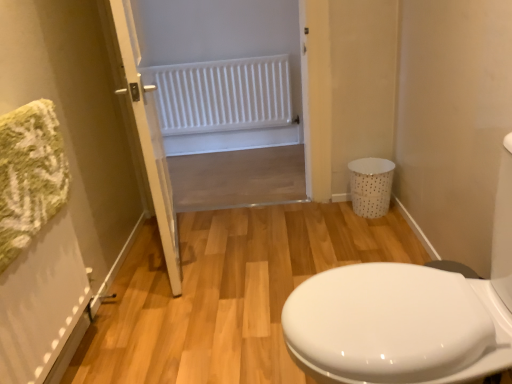
Question: Is white glossy porcelain at right wider or thinner than white matte radiator at upper center?

Choices:
 (A) wide
 (B) thin

Answer: (A)

Question: Considering their positions, is white glossy porcelain at right located in front of or behind white matte radiator at upper center?

Choices:
 (A) behind
 (B) front

Answer: (B)

Question: Considering the real-world distances, which object is closest to the white plastic radiator at upper center?

Choices:
 (A) white wooden door at center
 (B) white glossy porcelain at right
 (C) white matte radiator at upper center
 (D) white dotted plastic laundry basket at right

Answer: (C)

Question: Based on their relative distances, which object is nearer to the white plastic radiator at upper center?

Choices:
 (A) white glossy porcelain at right
 (B) white dotted plastic laundry basket at right
 (C) white wooden door at center
 (D) white matte radiator at upper center

Answer: (D)